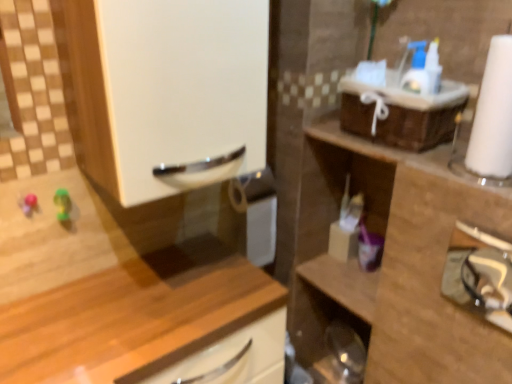
Question: From a real-world perspective, does translucent plastic container at center-right, which appears as the first toiletry when viewed from the left, sit lower than wooden cabinet at right, which is counted as the first cabinetry, starting from the right?

Choices:
 (A) no
 (B) yes

Answer: (A)

Question: Considering the relative sizes of translucent plastic container at center-right, which appears as the first toiletry when viewed from the left, and wooden cabinet at right, which is counted as the first cabinetry, starting from the right, in the image provided, is translucent plastic container at center-right, which appears as the first toiletry when viewed from the left, thinner than wooden cabinet at right, which is counted as the first cabinetry, starting from the right,?

Choices:
 (A) yes
 (B) no

Answer: (A)

Question: Is translucent plastic container at center-right, which appears as the first toiletry when viewed from the left, positioned beyond the bounds of wooden cabinet at right, which is counted as the first cabinetry, starting from the right?

Choices:
 (A) no
 (B) yes

Answer: (A)

Question: From the image's perspective, is translucent plastic container at center-right, which is counted as the second toiletry, starting from the right, located beneath wooden cabinet at right, which is counted as the first cabinetry, starting from the right?

Choices:
 (A) yes
 (B) no

Answer: (B)

Question: Considering the relative sizes of translucent plastic container at center-right, which is counted as the second toiletry, starting from the right, and wooden cabinet at right, acting as the second cabinetry starting from the left, in the image provided, is translucent plastic container at center-right, which is counted as the second toiletry, starting from the right, wider than wooden cabinet at right, acting as the second cabinetry starting from the left,?

Choices:
 (A) no
 (B) yes

Answer: (A)

Question: In the image, is translucent plastic container at center-right, which appears as the first toiletry when viewed from the left, on the left side or the right side of wooden cabinet at lower left, the second cabinetry in the right-to-left sequence?

Choices:
 (A) right
 (B) left

Answer: (A)

Question: In terms of width, does translucent plastic container at center-right, which is counted as the second toiletry, starting from the right, look wider or thinner when compared to wooden cabinet at lower left, marked as the first cabinetry in a left-to-right arrangement?

Choices:
 (A) wide
 (B) thin

Answer: (B)

Question: In terms of height, does translucent plastic container at center-right, which appears as the first toiletry when viewed from the left, look taller or shorter compared to wooden cabinet at lower left, the second cabinetry in the right-to-left sequence?

Choices:
 (A) tall
 (B) short

Answer: (B)

Question: Considering their positions, is translucent plastic container at center-right, which appears as the first toiletry when viewed from the left, located in front of or behind wooden cabinet at lower left, marked as the first cabinetry in a left-to-right arrangement?

Choices:
 (A) behind
 (B) front

Answer: (A)

Question: From a real-world perspective, is translucent plastic container at center-right, which is counted as the second toiletry, starting from the right, physically located above or below white glossy cabinet handle at upper left?

Choices:
 (A) below
 (B) above

Answer: (A)

Question: In terms of width, does translucent plastic container at center-right, which is counted as the second toiletry, starting from the right, look wider or thinner when compared to white glossy cabinet handle at upper left?

Choices:
 (A) thin
 (B) wide

Answer: (A)

Question: In terms of size, does translucent plastic container at center-right, which appears as the first toiletry when viewed from the left, appear bigger or smaller than white glossy cabinet handle at upper left?

Choices:
 (A) big
 (B) small

Answer: (B)

Question: From the image's perspective, relative to white glossy cabinet handle at upper left, is translucent plastic container at center-right, which is counted as the second toiletry, starting from the right, above or below?

Choices:
 (A) below
 (B) above

Answer: (A)

Question: Considering their positions, is metallic silver hairdryer at right located in front of or behind translucent plastic container at center-right, which is counted as the second toiletry, starting from the right?

Choices:
 (A) front
 (B) behind

Answer: (A)

Question: Based on their sizes in the image, would you say metallic silver hairdryer at right is bigger or smaller than translucent plastic container at center-right, which appears as the first toiletry when viewed from the left?

Choices:
 (A) big
 (B) small

Answer: (A)